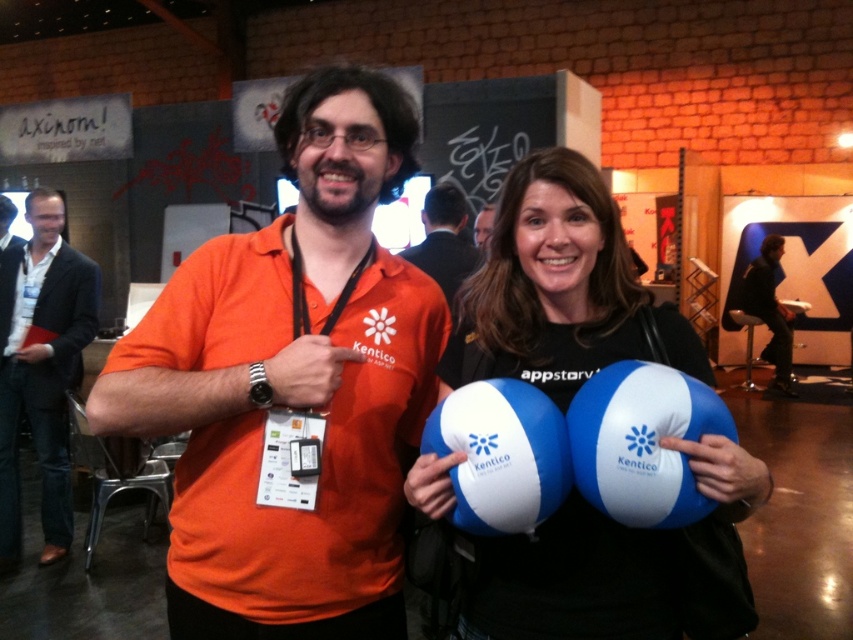
The image size is (853, 640). Identify the location of blue/white beach ball at center. (642, 442).

Does blue/white beach ball at center appear over matte black hair at upper center?

No, blue/white beach ball at center is not above matte black hair at upper center.

Is point (693, 387) positioned before point (488, 228)?

That is True.

Identify the location of blue/white beach ball at center. (642, 442).

Which is below, white/inflatable beach ball at center or matte black hair at upper center?

white/inflatable beach ball at center

Is white/inflatable beach ball at center taller than matte black hair at upper center?

In fact, white/inflatable beach ball at center may be shorter than matte black hair at upper center.

Is point (547, 452) in front of point (491, 212)?

Yes, point (547, 452) is in front of point (491, 212).

Where is `white/inflatable beach ball at center`? white/inflatable beach ball at center is located at coordinates (502, 454).

Does blue/white beach ball at center appear on the left side of orange fabric shirt at center?

In fact, blue/white beach ball at center is to the right of orange fabric shirt at center.

Does blue/white beach ball at center have a greater height compared to orange fabric shirt at center?

No, blue/white beach ball at center is not taller than orange fabric shirt at center.

The height and width of the screenshot is (640, 853). What are the coordinates of `blue/white beach ball at center` in the screenshot? It's located at (642, 442).

Identify the location of blue/white beach ball at center. This screenshot has height=640, width=853. (642, 442).